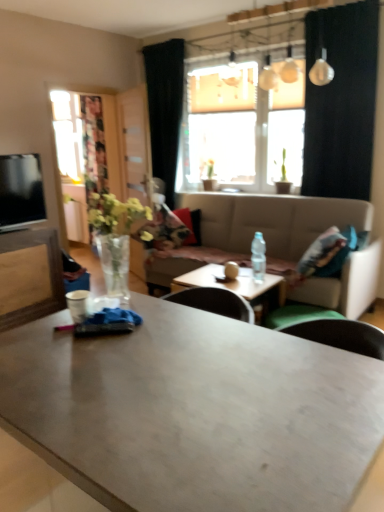
I want to click on free location in front of clear glass vase at left, so click(113, 326).